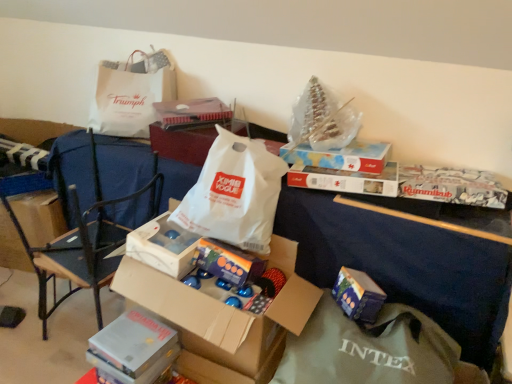
Question: From the image's perspective, is cardboard box at center above or below blue glossy box at lower right, the second gift in the left-to-right sequence?

Choices:
 (A) below
 (B) above

Answer: (B)

Question: Considering their positions, is cardboard box at center located in front of or behind blue glossy box at lower right, the second gift in the left-to-right sequence?

Choices:
 (A) front
 (B) behind

Answer: (A)

Question: Which of these objects is positioned closest to the black metal chair at left?

Choices:
 (A) cardboard box at center
 (B) white paper bag at center, which ranks as the 5th storage box in bottom-to-top order
 (C) shiny metallic box at center, which is counted as the second gift, starting from the right
 (D) white paper bag at center
 (E) white cardboard box at upper center, the 3th storage box positioned from the top

Answer: (A)

Question: Which is nearer to the white cardboard box at upper center, the 3th storage box positioned from the top?

Choices:
 (A) matte cardboard box at upper center, the 2th storage box in the top-to-bottom sequence
 (B) white paper bag at center, the first grocery bag in the bottom-to-top sequence
 (C) blue glossy box at lower right, the second gift in the left-to-right sequence
 (D) white paper bag at upper left, placed as the first grocery bag when sorted from left to right
 (E) black metal chair at left

Answer: (A)